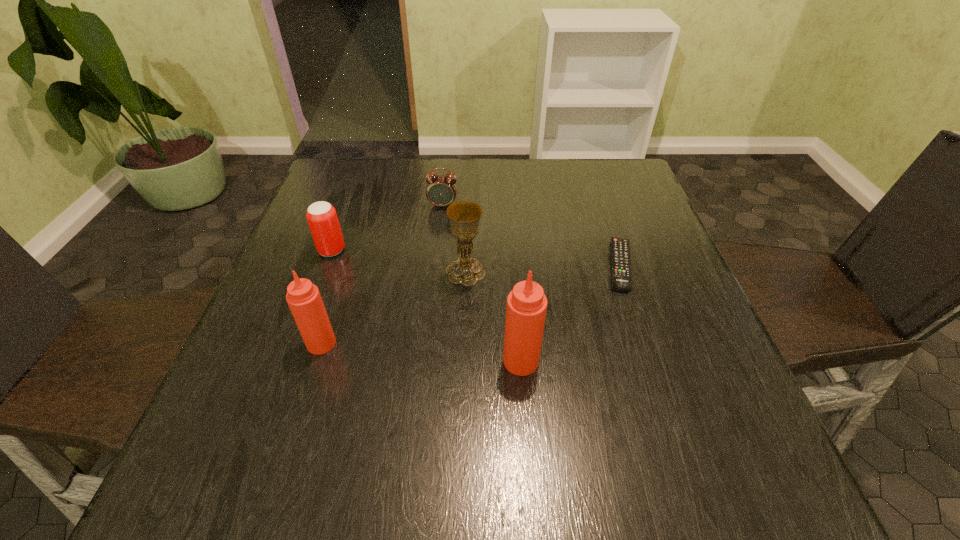
In order to click on the left Tabasco sauce in this screenshot , I will do `click(304, 299)`.

Where is `the tallest object`? The image size is (960, 540). the tallest object is located at coordinates (526, 307).

At what (x,y) coordinates should I click in order to perform the action: click on the fifth object from left to right. Please return your answer as a coordinate pair (x, y). Looking at the image, I should click on (526, 307).

Identify the location of alarm clock. The image size is (960, 540). 441,190.

This screenshot has width=960, height=540. In order to click on the rightmost object in this screenshot , I will do [620, 252].

Identify the location of the shortest object. (620, 252).

Identify the location of beer can. The image size is (960, 540). (322, 218).

At what (x,y) coordinates should I click in order to perform the action: click on chalice. Please return your answer as a coordinate pair (x, y). The width and height of the screenshot is (960, 540). Looking at the image, I should click on (464, 216).

I want to click on vacant area situated on the right of the left Tabasco sauce, so click(x=504, y=343).

Find the location of a particular element. This screenshot has width=960, height=540. vacant space located on the right of the fifth object from left to right is located at coordinates (615, 361).